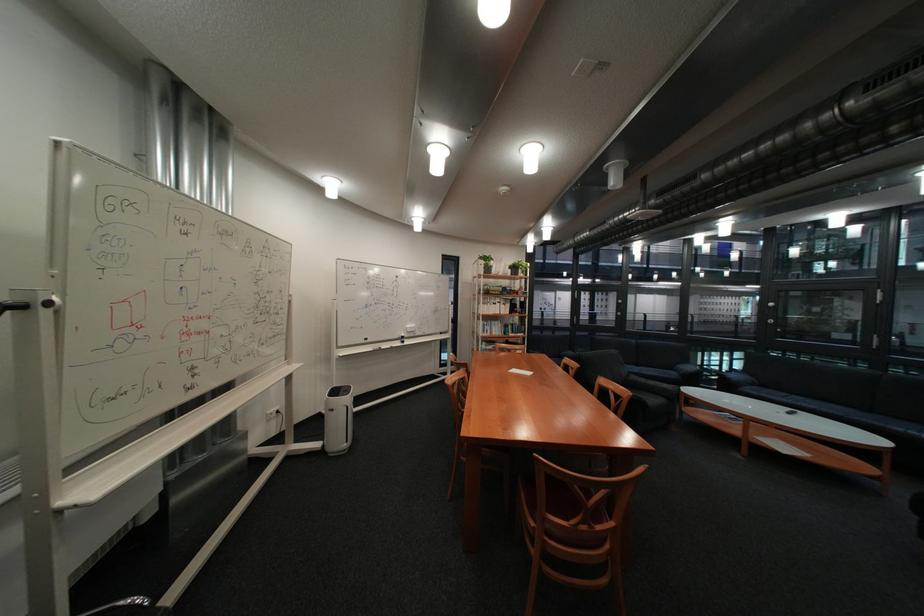
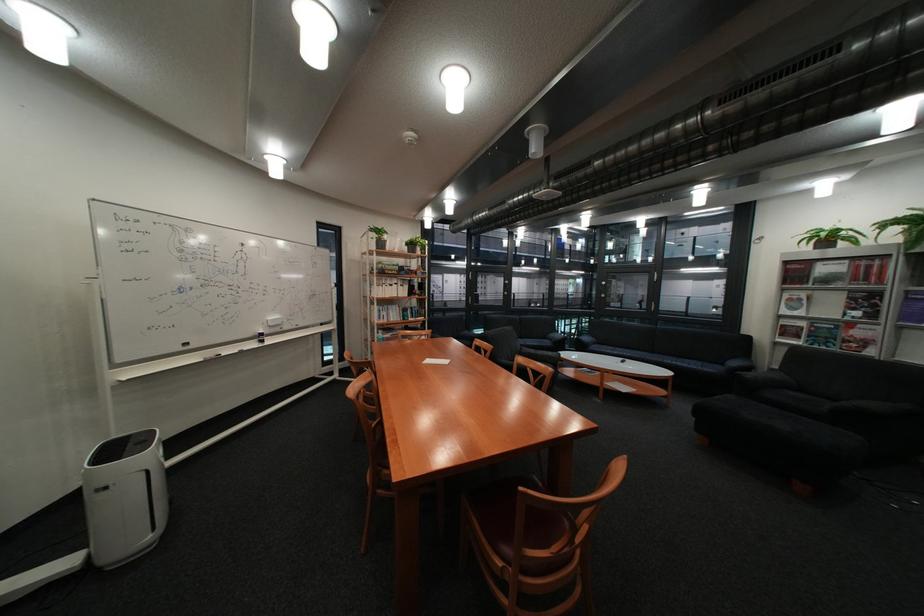
Where in the second image is the point corresponding to point (667, 383) from the first image?

(555, 353)